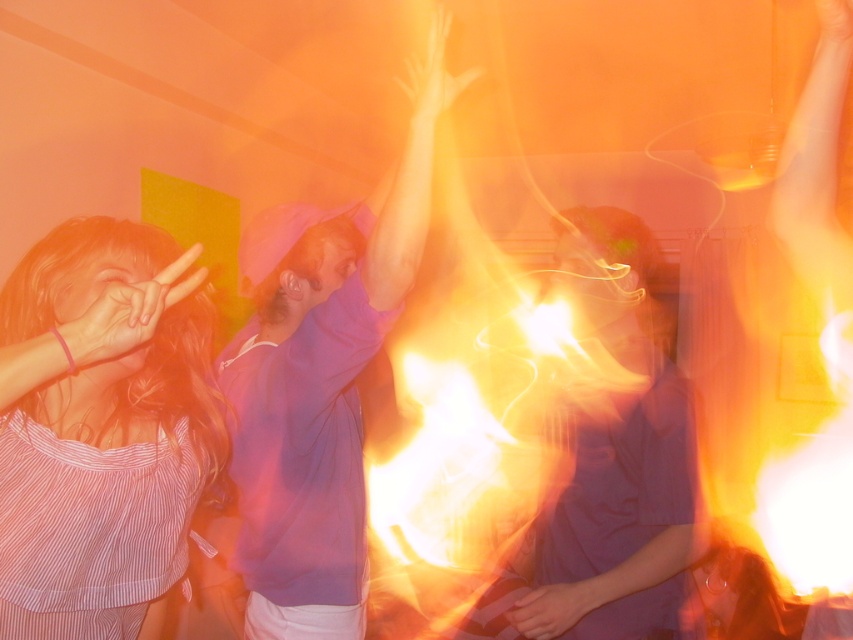
Question: Which point is closer to the camera?

Choices:
 (A) (350, 637)
 (B) (111, 444)
 (C) (663, 461)

Answer: (B)

Question: Is striped fabric shirt at left positioned in front of purple matte shirt at center?

Choices:
 (A) no
 (B) yes

Answer: (B)

Question: Does striped fabric shirt at left appear on the right side of purple matte shirt at center?

Choices:
 (A) yes
 (B) no

Answer: (B)

Question: Which point is closer to the camera taking this photo?

Choices:
 (A) (61, 356)
 (B) (276, 301)

Answer: (A)

Question: Is striped fabric shirt at left to the right of purple matte shirt at center from the viewer's perspective?

Choices:
 (A) no
 (B) yes

Answer: (A)

Question: Based on their relative distances, which object is nearer to the purple matte shirt at center?

Choices:
 (A) striped fabric shirt at left
 (B) purple matte hoodie at center

Answer: (B)